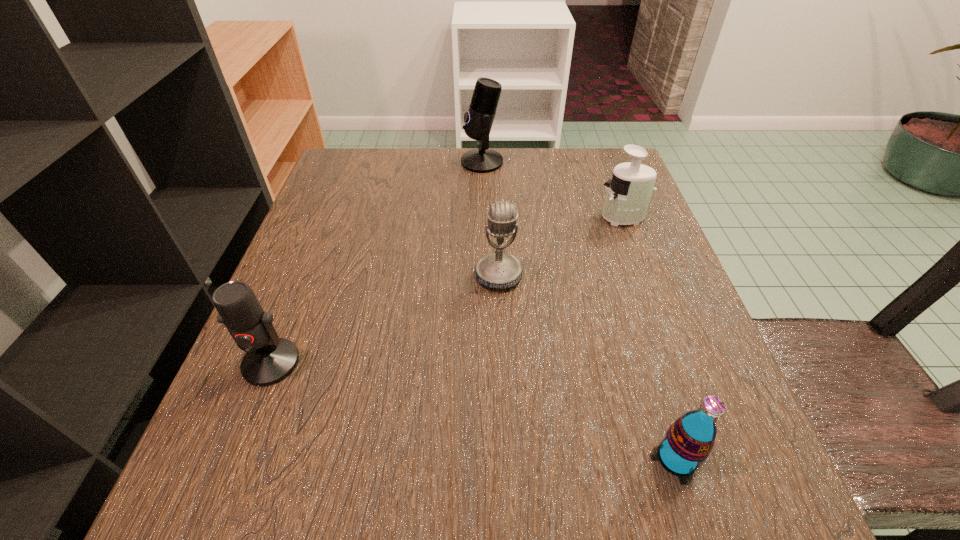
At what (x,y) coordinates should I click in order to perform the action: click on empty space between the farthest object and the leftmost object. Please return your answer as a coordinate pair (x, y). The width and height of the screenshot is (960, 540). Looking at the image, I should click on (376, 262).

This screenshot has height=540, width=960. I want to click on blank region between the farthest object and the juicer, so click(553, 190).

The height and width of the screenshot is (540, 960). Identify the location of free area in between the shortest object and the farthest microphone. (579, 310).

Identify the location of free spot between the juicer and the second farthest microphone. The height and width of the screenshot is (540, 960). (561, 246).

This screenshot has height=540, width=960. In order to click on free space between the leftmost microphone and the soda in this screenshot , I will do `click(474, 410)`.

At what (x,y) coordinates should I click in order to perform the action: click on empty space that is in between the shortest object and the fourth nearest object. Please return your answer as a coordinate pair (x, y). The image size is (960, 540). Looking at the image, I should click on (650, 338).

Choose which object is the nearest neighbor to the juicer. Please provide its 2D coordinates. Your answer should be formatted as a tuple, i.e. [(x, y)], where the tuple contains the x and y coordinates of a point satisfying the conditions above.

[(498, 270)]

The image size is (960, 540). In order to click on object that is the closest to the farthest object in this screenshot , I will do `click(629, 192)`.

Where is `microphone that is the second closest to the juicer`? This screenshot has width=960, height=540. microphone that is the second closest to the juicer is located at coordinates (479, 119).

Locate an element on the screen. The height and width of the screenshot is (540, 960). the closest microphone to the tallest microphone is located at coordinates (498, 270).